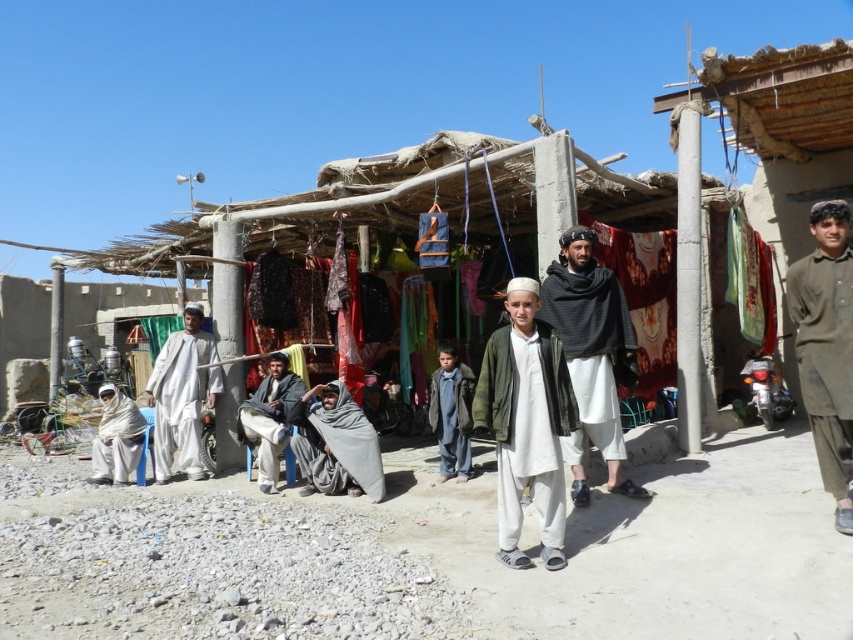
You are a traveler who wants to greet the person wearing the dark gray woolen robe at center and the white cotton robe at lower left. If you are standing at the entrance of the stall, which direction should you walk to reach both people first?

Since the dark gray woolen robe at center is closer to the entrance than the white cotton robe at lower left, you should walk towards the center to reach the person in the dark gray woolen robe first.

You are a traveler who just arrived at the market stall. You want to buy a green matte jacket at center. Where should you look to find it?

The green matte jacket at center is located at point 0.666 on the x axis and 0.618 on the y axis.

You are a tailor trying to decide which garment to display first. The brown cotton shirt at right and the dark gray woolen robe at center are both on your stall. Which garment is narrower?

The brown cotton shirt at right has a lesser width compared to the dark gray woolen robe at center, so the brown cotton shirt at right is narrower.